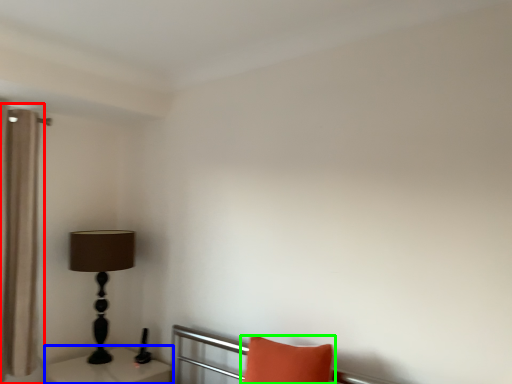
Question: Estimate the real-world distances between objects in this image. Which object is closer to curtain (highlighted by a red box), table (highlighted by a blue box) or pillow (highlighted by a green box)?

Choices:
 (A) table
 (B) pillow

Answer: (A)